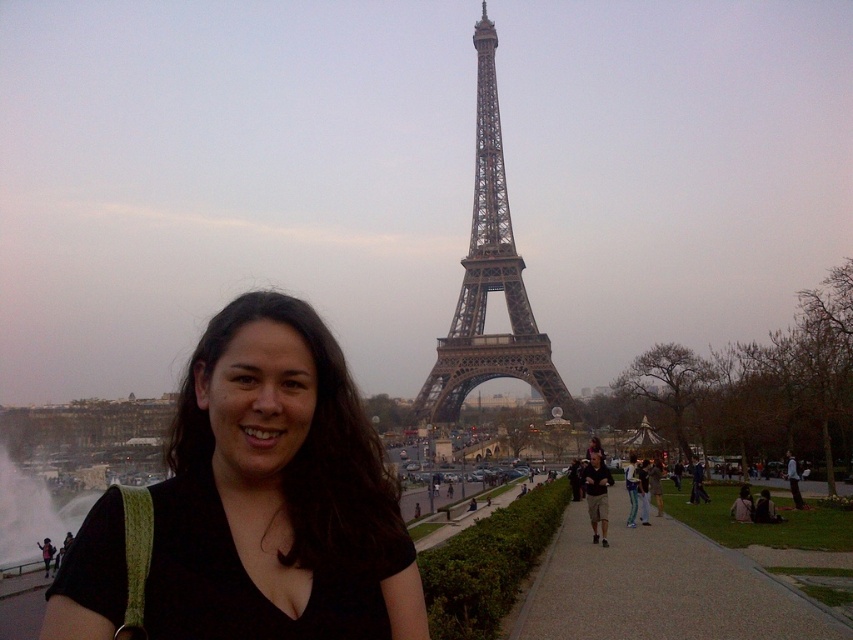
Is black matte shirt at center further to camera compared to matte black shirt at center?

No, it is in front of matte black shirt at center.

Can you confirm if black matte shirt at center is smaller than matte black shirt at center?

Incorrect, black matte shirt at center is not smaller in size than matte black shirt at center.

I want to click on black matte shirt at center, so click(254, 502).

Can you confirm if metallic brown eiffel tower at center is positioned below matte black shirt at center?

No, metallic brown eiffel tower at center is not below matte black shirt at center.

Can you confirm if metallic brown eiffel tower at center is positioned above matte black shirt at center?

Yes.

What do you see at coordinates (488, 280) in the screenshot? The width and height of the screenshot is (853, 640). I see `metallic brown eiffel tower at center` at bounding box center [488, 280].

The width and height of the screenshot is (853, 640). Find the location of `metallic brown eiffel tower at center`. metallic brown eiffel tower at center is located at coordinates (488, 280).

Is black matte shirt at center closer to the viewer compared to metallic brown eiffel tower at center?

No, black matte shirt at center is behind metallic brown eiffel tower at center.

Is black matte shirt at center behind metallic brown eiffel tower at center?

Yes, it is behind metallic brown eiffel tower at center.

You are a GUI agent. You are given a task and a screenshot of the screen. Output one action in this format:
    pyautogui.click(x=<x>, y=<y>)
    Task: Click on the black matte shirt at center
    
    Given the screenshot: What is the action you would take?
    pyautogui.click(x=254, y=502)